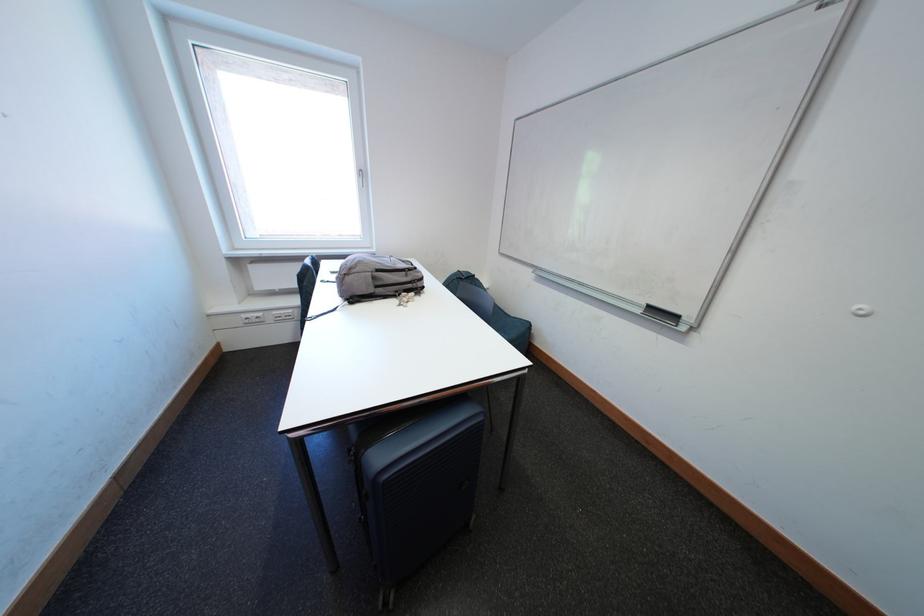
Image resolution: width=924 pixels, height=616 pixels. In order to click on grey backpack handle in this screenshot , I will do `click(405, 299)`.